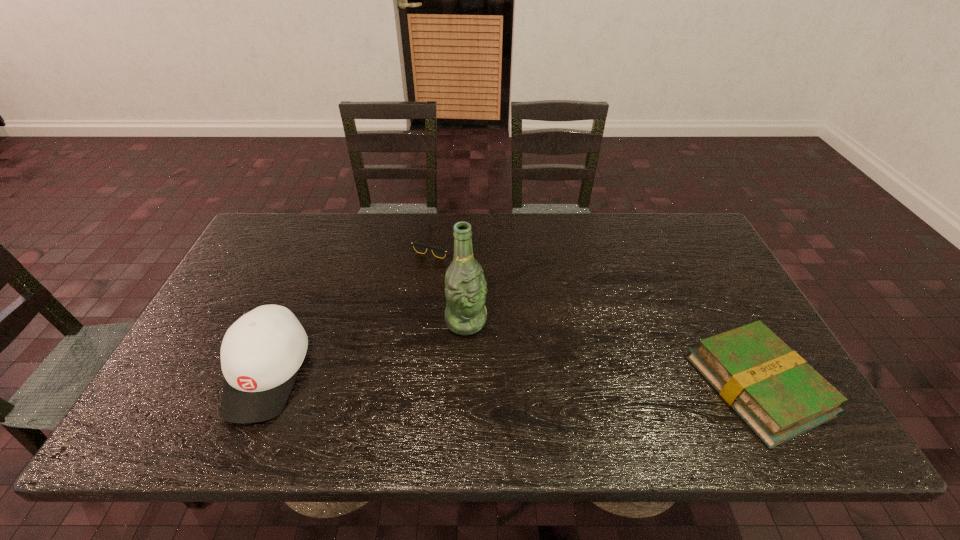
You are a GUI agent. You are given a task and a screenshot of the screen. Output one action in this format:
    pyautogui.click(x=<x>, y=<y>)
    Task: Click on the object that is at the near right corner
    The image size is (960, 540).
    Given the screenshot: What is the action you would take?
    pyautogui.click(x=774, y=390)

In the image, there is a desktop. Identify the location of vacant space at the far edge. (372, 242).

Locate an element on the screen. This screenshot has width=960, height=540. vacant area at the near edge of the desktop is located at coordinates (305, 383).

The image size is (960, 540). In the image, there is a desktop. In order to click on free space at the left edge in this screenshot , I will do `click(269, 281)`.

You are a GUI agent. You are given a task and a screenshot of the screen. Output one action in this format:
    pyautogui.click(x=<x>, y=<y>)
    Task: Click on the free space at the far left corner
    The width and height of the screenshot is (960, 540).
    Given the screenshot: What is the action you would take?
    pyautogui.click(x=269, y=214)

Locate an element on the screen. Image resolution: width=960 pixels, height=540 pixels. free space between the beer bottle and the book is located at coordinates (612, 353).

Image resolution: width=960 pixels, height=540 pixels. In order to click on vacant area that lies between the rightmost object and the tallest object in this screenshot , I will do `click(612, 353)`.

The height and width of the screenshot is (540, 960). In order to click on free space between the shortest object and the baseball cap in this screenshot , I will do `click(352, 308)`.

This screenshot has height=540, width=960. What are the coordinates of `free spot between the leftmost object and the tallest object` in the screenshot? It's located at [x=367, y=347].

Locate an element on the screen. The height and width of the screenshot is (540, 960). vacant space in between the farthest object and the book is located at coordinates (598, 314).